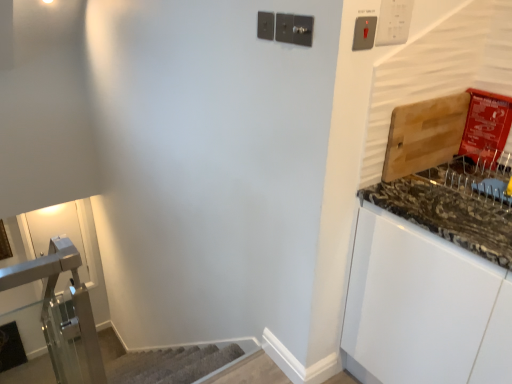
Question: Is metallic silver light switch at upper right, which is counted as the 2th light switch, starting from the left, smaller than satin nickel light switch at upper center, marked as the third light switch in a right-to-left arrangement?

Choices:
 (A) no
 (B) yes

Answer: (B)

Question: Is metallic silver light switch at upper right, which is counted as the 2th light switch, starting from the left, bigger than satin nickel light switch at upper center, placed as the first light switch when sorted from left to right?

Choices:
 (A) no
 (B) yes

Answer: (A)

Question: Is metallic silver light switch at upper right, the second light switch in the right-to-left sequence, beside satin nickel light switch at upper center, placed as the first light switch when sorted from left to right?

Choices:
 (A) yes
 (B) no

Answer: (B)

Question: Is satin nickel light switch at upper center, marked as the third light switch in a right-to-left arrangement, located within metallic silver light switch at upper right, the second light switch in the right-to-left sequence?

Choices:
 (A) no
 (B) yes

Answer: (A)

Question: Can you confirm if metallic silver light switch at upper right, the second light switch in the right-to-left sequence, is wider than satin nickel light switch at upper center, placed as the first light switch when sorted from left to right?

Choices:
 (A) yes
 (B) no

Answer: (B)

Question: Is metallic silver light switch at upper right, the second light switch in the right-to-left sequence, shorter than satin nickel light switch at upper center, placed as the first light switch when sorted from left to right?

Choices:
 (A) yes
 (B) no

Answer: (B)

Question: From a real-world perspective, does satin nickel light switch at upper center, marked as the third light switch in a right-to-left arrangement, sit lower than white plastic light switch at upper right, the first light switch from the right?

Choices:
 (A) yes
 (B) no

Answer: (A)

Question: Considering the relative sizes of satin nickel light switch at upper center, marked as the third light switch in a right-to-left arrangement, and white plastic light switch at upper right, which is the third light switch in left-to-right order, in the image provided, is satin nickel light switch at upper center, marked as the third light switch in a right-to-left arrangement, shorter than white plastic light switch at upper right, which is the third light switch in left-to-right order,?

Choices:
 (A) yes
 (B) no

Answer: (A)

Question: Is white plastic light switch at upper right, the first light switch from the right, surrounded by satin nickel light switch at upper center, marked as the third light switch in a right-to-left arrangement?

Choices:
 (A) no
 (B) yes

Answer: (A)

Question: Is satin nickel light switch at upper center, marked as the third light switch in a right-to-left arrangement, at the left side of white plastic light switch at upper right, the first light switch from the right?

Choices:
 (A) no
 (B) yes

Answer: (B)

Question: Is satin nickel light switch at upper center, placed as the first light switch when sorted from left to right, oriented towards white plastic light switch at upper right, which is the third light switch in left-to-right order?

Choices:
 (A) yes
 (B) no

Answer: (B)

Question: Is satin nickel light switch at upper center, placed as the first light switch when sorted from left to right, closer to the viewer compared to white plastic light switch at upper right, which is the third light switch in left-to-right order?

Choices:
 (A) yes
 (B) no

Answer: (B)

Question: From the image's perspective, does metallic silver light switch at upper right, which is counted as the 2th light switch, starting from the left, appear lower than white plastic light switch at upper right, which is the third light switch in left-to-right order?

Choices:
 (A) no
 (B) yes

Answer: (B)